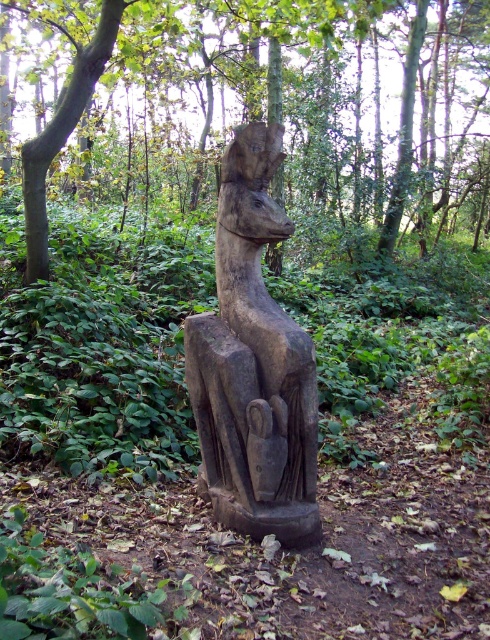
Question: Is smooth brown statue at center further to camera compared to dark brown wood statue at center?

Choices:
 (A) no
 (B) yes

Answer: (B)

Question: Among these points, which one is farthest from the camera?

Choices:
 (A) (265, 164)
 (B) (460, 74)

Answer: (B)

Question: Observing the image, what is the correct spatial positioning of smooth brown statue at center in reference to dark brown wood statue at center?

Choices:
 (A) above
 (B) below

Answer: (A)

Question: Is smooth brown statue at center above dark brown wood statue at center?

Choices:
 (A) no
 (B) yes

Answer: (B)